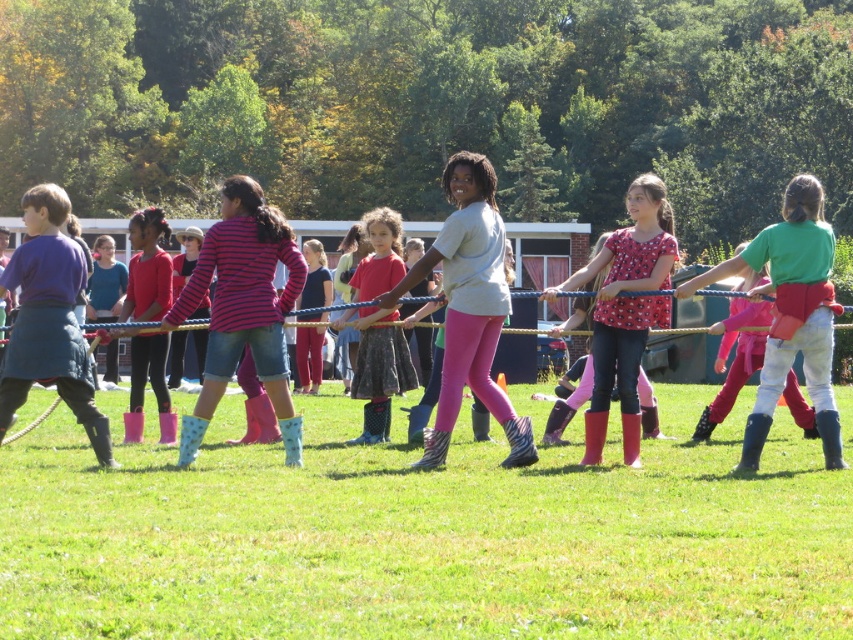
Question: Which of the following is the closest to the observer?

Choices:
 (A) green rubber boots at center
 (B) pink zebra-patterned leggings at center
 (C) matte pink skirt at center

Answer: (B)

Question: Is matte purple jacket at left further to the viewer compared to pink rubber boots at center?

Choices:
 (A) yes
 (B) no

Answer: (B)

Question: Which object is positioned closest to the green rubber boots at center?

Choices:
 (A) matte pink skirt at center
 (B) red matte leggings at center

Answer: (B)

Question: Is the position of pink striped shirt at center less distant than that of green fabric shirt at center?

Choices:
 (A) no
 (B) yes

Answer: (B)

Question: Considering the real-world distances, which object is farthest from the green fabric shirt at center?

Choices:
 (A) pink zebra-patterned leggings at center
 (B) red matte leggings at center
 (C) green rubber boots at center

Answer: (A)

Question: Is pink zebra-patterned leggings at center below matte purple jacket at left?

Choices:
 (A) yes
 (B) no

Answer: (B)